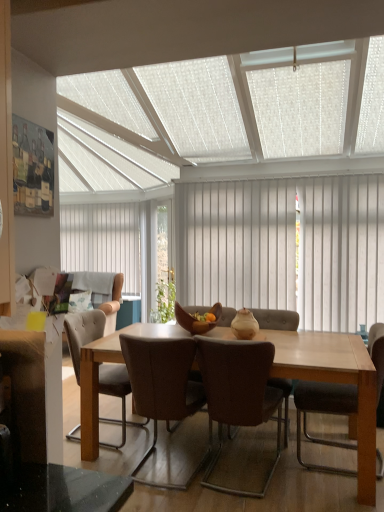
Locate an element on the screen. Image resolution: width=384 pixels, height=512 pixels. free location above white vertical blinds at center, the second curtain positioned from the left (from a real-world perspective) is located at coordinates (277, 169).